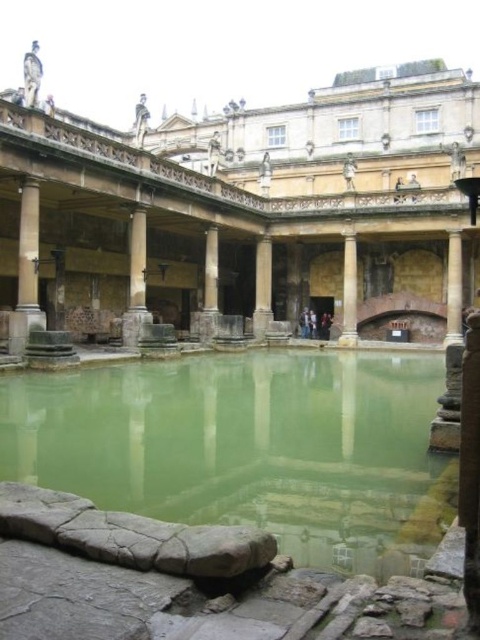
You are a tourist standing at the entrance of the Roman Baths and want to take a photo of the smooth stone pillar at center and the gray stone pillar at center. Which pillar should you focus on first if you want to capture both in the frame without moving your camera?

You should focus on the smooth stone pillar at center first because it is closer to you than the gray stone pillar at center, allowing both pillars to be in the frame without moving the camera.